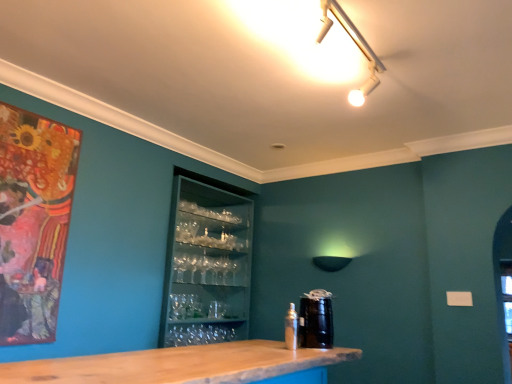
Question: Does matte black lampshade at center have a smaller size compared to metallic silver spray can at lower center?

Choices:
 (A) no
 (B) yes

Answer: (A)

Question: Does matte black lampshade at center appear on the left side of metallic silver spray can at lower center?

Choices:
 (A) yes
 (B) no

Answer: (B)

Question: From the image's perspective, is matte black lampshade at center located beneath metallic silver spray can at lower center?

Choices:
 (A) no
 (B) yes

Answer: (A)

Question: Is matte black lampshade at center positioned far away from metallic silver spray can at lower center?

Choices:
 (A) yes
 (B) no

Answer: (A)

Question: Is metallic silver spray can at lower center inside matte black lampshade at center?

Choices:
 (A) yes
 (B) no

Answer: (B)

Question: Does point (32, 129) appear closer or farther from the camera than point (307, 326)?

Choices:
 (A) closer
 (B) farther

Answer: (A)

Question: In terms of width, does matte wooden picture frame at left look wider or thinner when compared to black glossy canister at center?

Choices:
 (A) thin
 (B) wide

Answer: (A)

Question: Is matte wooden picture frame at left inside the boundaries of black glossy canister at center, or outside?

Choices:
 (A) outside
 (B) inside

Answer: (A)

Question: From the image's perspective, is matte wooden picture frame at left above or below black glossy canister at center?

Choices:
 (A) below
 (B) above

Answer: (B)

Question: From a real-world perspective, is matte wooden picture frame at left above or below transparent glassware at center?

Choices:
 (A) below
 (B) above

Answer: (B)

Question: Is matte wooden picture frame at left bigger or smaller than transparent glassware at center?

Choices:
 (A) big
 (B) small

Answer: (B)

Question: From the image's perspective, is matte wooden picture frame at left above or below transparent glassware at center?

Choices:
 (A) below
 (B) above

Answer: (B)

Question: Relative to transparent glassware at center, is matte wooden picture frame at left in front or behind?

Choices:
 (A) front
 (B) behind

Answer: (A)

Question: From their relative heights in the image, would you say metallic silver spray can at lower center is taller or shorter than transparent glassware at center?

Choices:
 (A) tall
 (B) short

Answer: (B)

Question: From the image's perspective, is metallic silver spray can at lower center positioned above or below transparent glassware at center?

Choices:
 (A) above
 (B) below

Answer: (B)